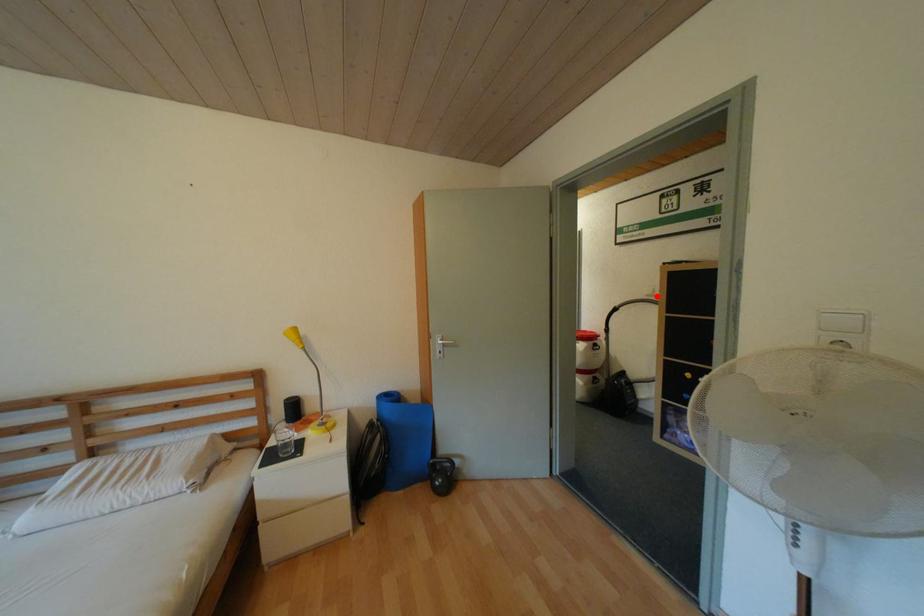
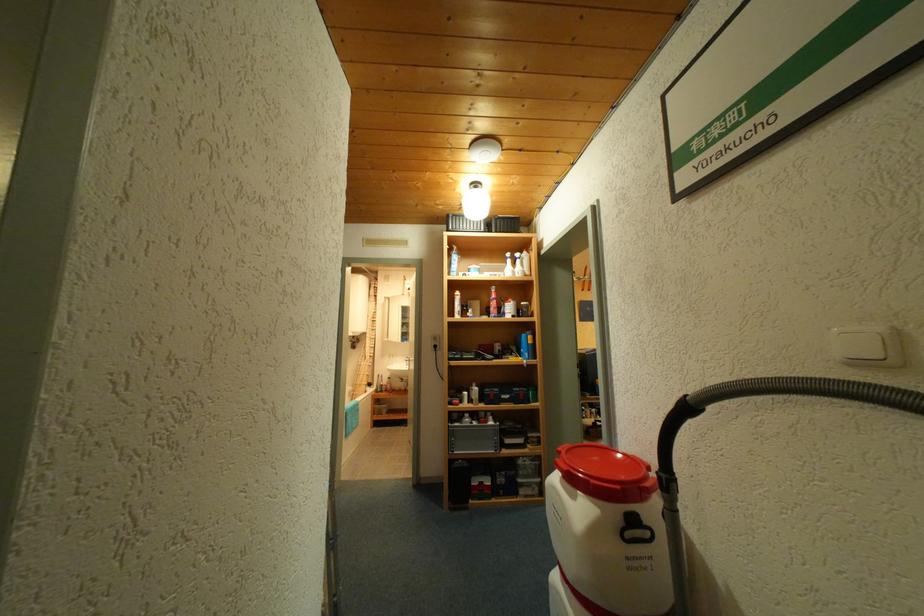
Where in the second image is the point corresponding to the highlighted location from the first image?

(868, 363)